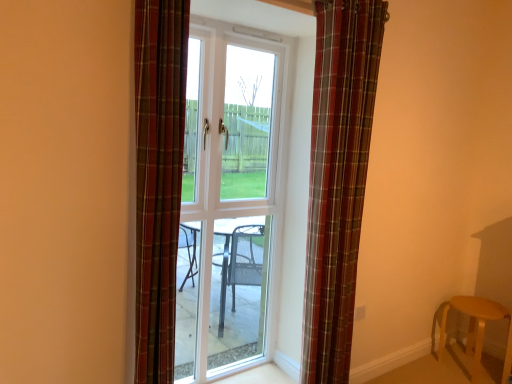
Question: Would you say wooden stool at lower right is a long distance from white glass door at center?

Choices:
 (A) yes
 (B) no

Answer: (A)

Question: Is the depth of wooden stool at lower right less than that of white glass door at center?

Choices:
 (A) no
 (B) yes

Answer: (A)

Question: Does wooden stool at lower right appear on the left side of white glass door at center?

Choices:
 (A) yes
 (B) no

Answer: (B)

Question: From the image's perspective, would you say wooden stool at lower right is positioned over white glass door at center?

Choices:
 (A) yes
 (B) no

Answer: (B)

Question: Considering the relative sizes of wooden stool at lower right and white glass door at center in the image provided, is wooden stool at lower right bigger than white glass door at center?

Choices:
 (A) yes
 (B) no

Answer: (B)

Question: Can you confirm if wooden stool at lower right is positioned to the right of white glass door at center?

Choices:
 (A) no
 (B) yes

Answer: (B)

Question: Is wooden stool at lower right to the left of plaid fabric curtain at center, the second curtain in the front-to-back sequence, from the viewer's perspective?

Choices:
 (A) yes
 (B) no

Answer: (B)

Question: Is wooden stool at lower right taller than plaid fabric curtain at center, positioned as the 1th curtain in back-to-front order?

Choices:
 (A) yes
 (B) no

Answer: (B)

Question: From the image's perspective, would you say wooden stool at lower right is positioned over plaid fabric curtain at center, positioned as the second curtain in left-to-right order?

Choices:
 (A) no
 (B) yes

Answer: (A)

Question: Considering the relative sizes of wooden stool at lower right and plaid fabric curtain at center, positioned as the second curtain in left-to-right order, in the image provided, is wooden stool at lower right thinner than plaid fabric curtain at center, positioned as the second curtain in left-to-right order,?

Choices:
 (A) yes
 (B) no

Answer: (B)

Question: Is wooden stool at lower right bigger than plaid fabric curtain at center, positioned as the second curtain in left-to-right order?

Choices:
 (A) no
 (B) yes

Answer: (A)

Question: Is wooden stool at lower right outside plaid fabric curtain at center, the second curtain in the front-to-back sequence?

Choices:
 (A) no
 (B) yes

Answer: (B)

Question: Is white glass door at center outside of plaid fabric curtain at center, which appears as the 1th curtain when viewed from the front?

Choices:
 (A) no
 (B) yes

Answer: (B)